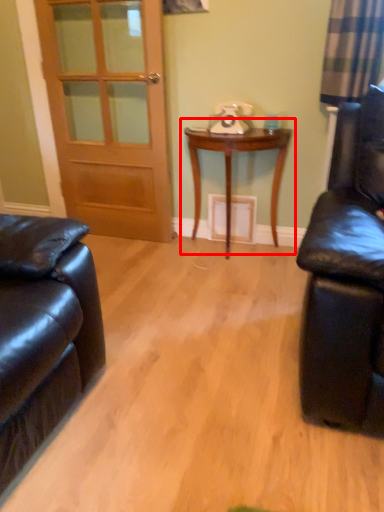
Question: From the image, what is the correct spatial relationship of table (annotated by the red box) in relation to door?

Choices:
 (A) right
 (B) left

Answer: (A)